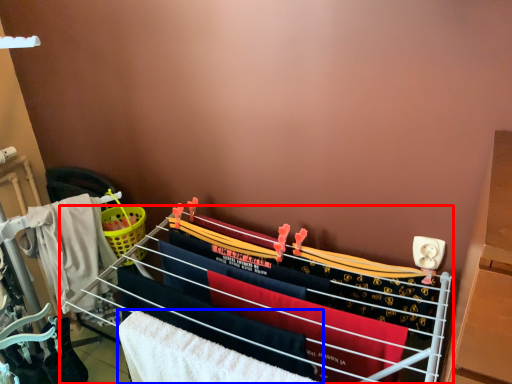
Question: Which object is further to the camera taking this photo, furniture (highlighted by a red box) or beach towel (highlighted by a blue box)?

Choices:
 (A) furniture
 (B) beach towel

Answer: (B)